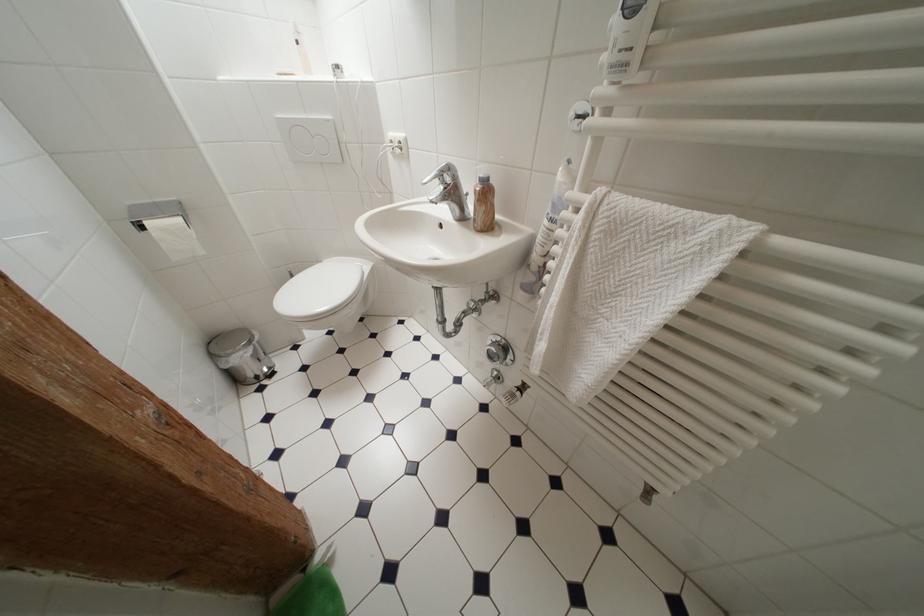
Find where to turn the radiator control knob. Please return your answer as a coordinate pair (x, y).

(546, 285)